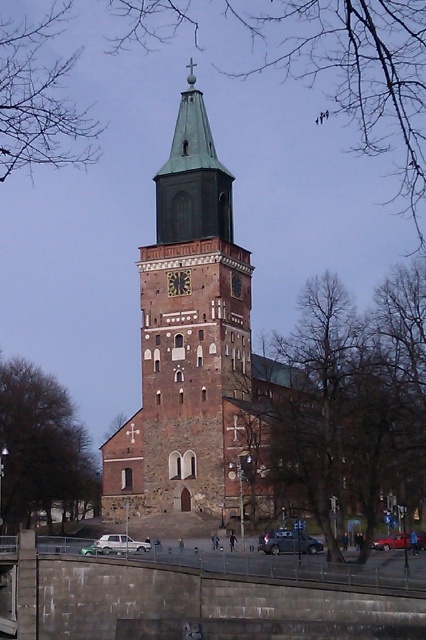
You are standing in front of the historic church and want to take a photo. You notice two points marked on the tower. Which point, point (169, 161) or point (176, 284), is closer to you?

Point (169, 161) is closer to you because it is further to the viewer than point (176, 284).

You are a tourist standing in front of the brown stone church at center and the green copper bell tower at center. Which structure would block your view if you tried to look over the other one?

The brown stone church at center is bigger than the green copper bell tower at center, so if you tried to look over the green copper bell tower at center, the brown stone church at center would block your view.

You are standing in front of the brown stone church at center and want to place a 10 meter long banner from the church to the dark brown stone clock at center. Will the banner be long enough?

The distance between the brown stone church at center and the dark brown stone clock at center is 8.59 meters. Since the banner is 10 meters long, it will be long enough to span the distance between them.